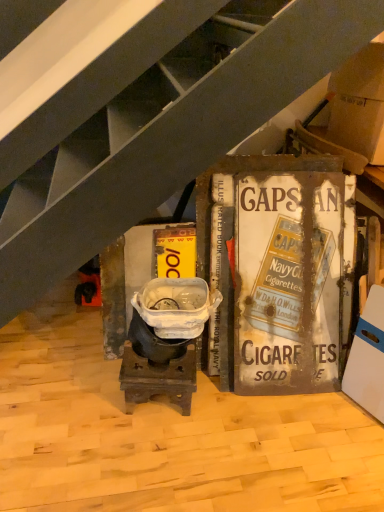
Locate an element on the screen. This screenshot has height=512, width=384. white paper at center is located at coordinates (288, 282).

What do you see at coordinates (288, 282) in the screenshot? The width and height of the screenshot is (384, 512). I see `white paper at center` at bounding box center [288, 282].

Image resolution: width=384 pixels, height=512 pixels. In order to click on white paper at center in this screenshot , I will do `click(288, 282)`.